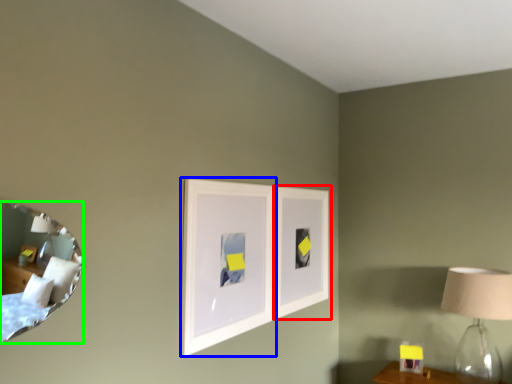
Question: Estimate the real-world distances between objects in this image. Which object is closer to picture frame (highlighted by a red box), picture frame (highlighted by a blue box) or mirror (highlighted by a green box)?

Choices:
 (A) picture frame
 (B) mirror

Answer: (A)